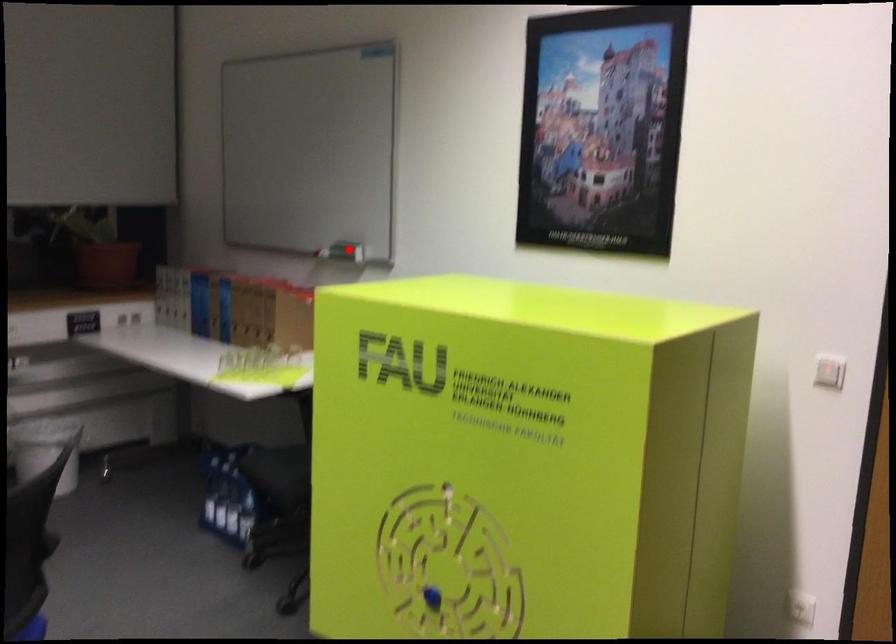
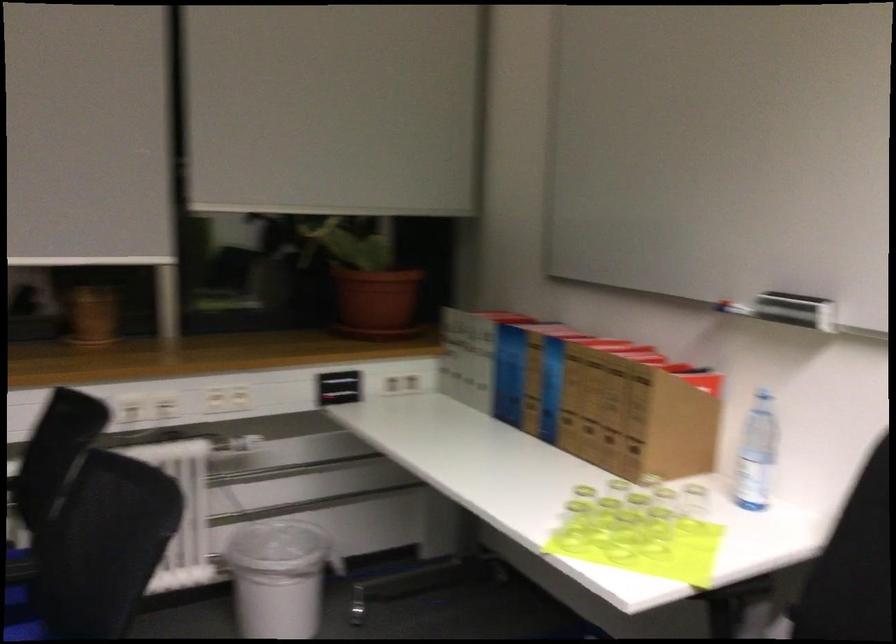
The point at the highlighted location is marked in the first image. Where is the corresponding point in the second image?

(795, 310)